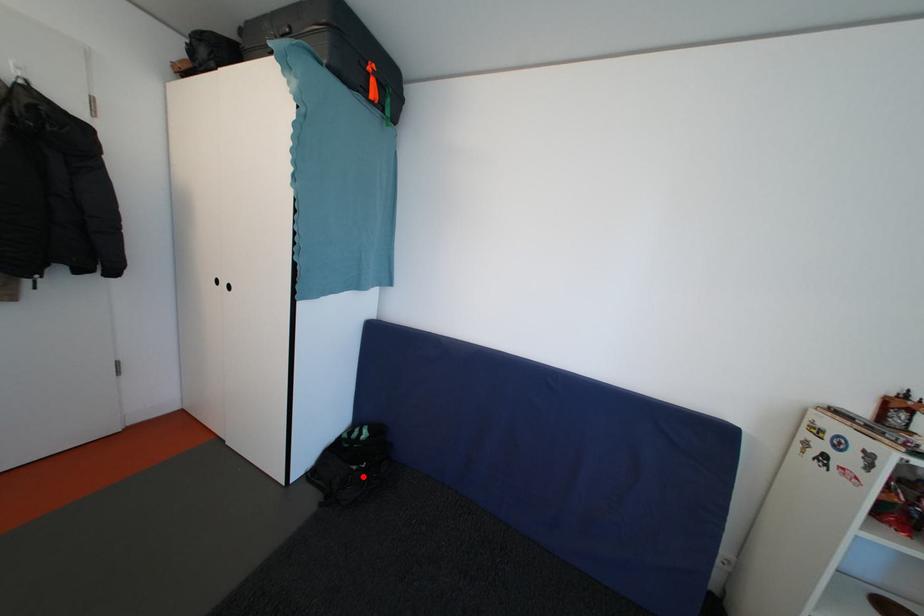
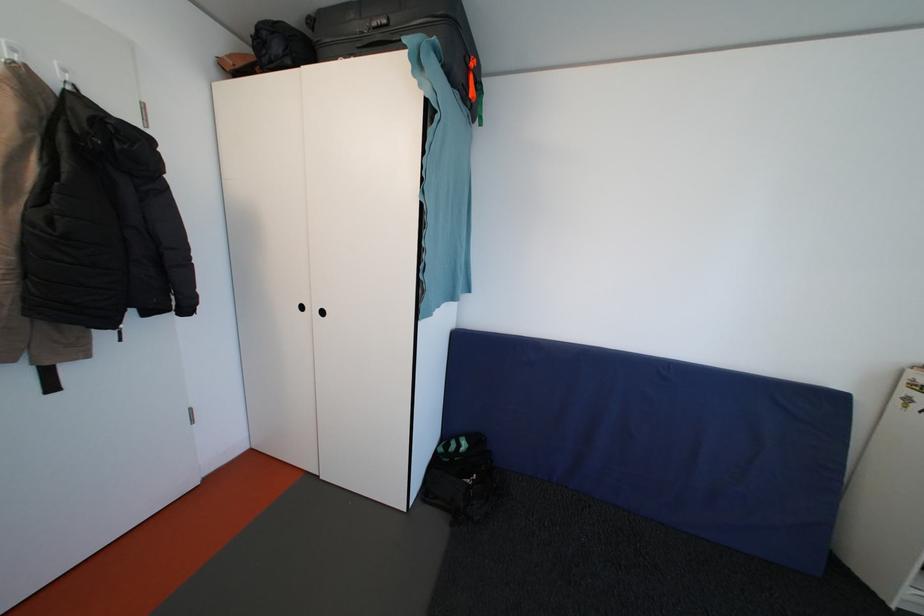
Find the pixel in the second image that matches the highlighted location in the first image.

(480, 490)